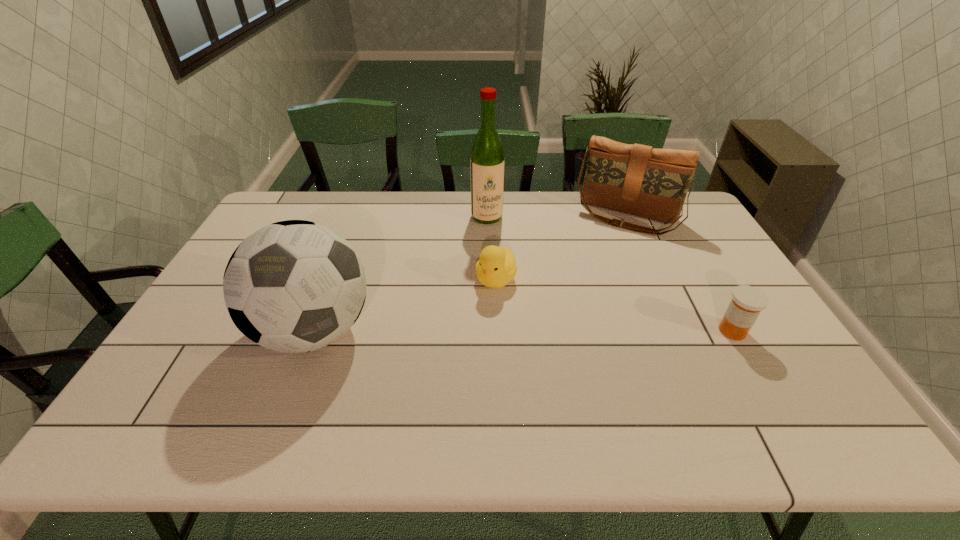
At what (x,y) coordinates should I click in order to perform the action: click on soccer ball. Please return your answer as a coordinate pair (x, y). This screenshot has height=540, width=960. Looking at the image, I should click on (293, 286).

Locate an element on the screen. Image resolution: width=960 pixels, height=540 pixels. the fourth shortest object is located at coordinates (293, 286).

Locate an element on the screen. The height and width of the screenshot is (540, 960). medicine is located at coordinates (747, 302).

Image resolution: width=960 pixels, height=540 pixels. I want to click on liquor, so click(x=487, y=162).

This screenshot has width=960, height=540. I want to click on shoulder bag, so click(636, 179).

Where is `duck`? The image size is (960, 540). duck is located at coordinates (496, 267).

Identify the location of vacant space located 0.090m on the label of the medicine. The width and height of the screenshot is (960, 540). (756, 371).

Find the location of a particular element. free space located on the label of the liquor is located at coordinates (507, 285).

Identify the location of vacant region located 0.310m on the label of the liquor. Image resolution: width=960 pixels, height=540 pixels. (507, 285).

Locate an element on the screen. The height and width of the screenshot is (540, 960). vacant point located on the label of the liquor is located at coordinates (504, 273).